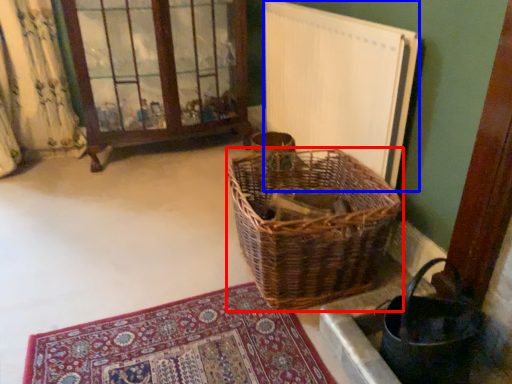
Question: Which object appears farthest to the camera in this image, picnic basket (highlighted by a red box) or radiator (highlighted by a blue box)?

Choices:
 (A) picnic basket
 (B) radiator

Answer: (B)